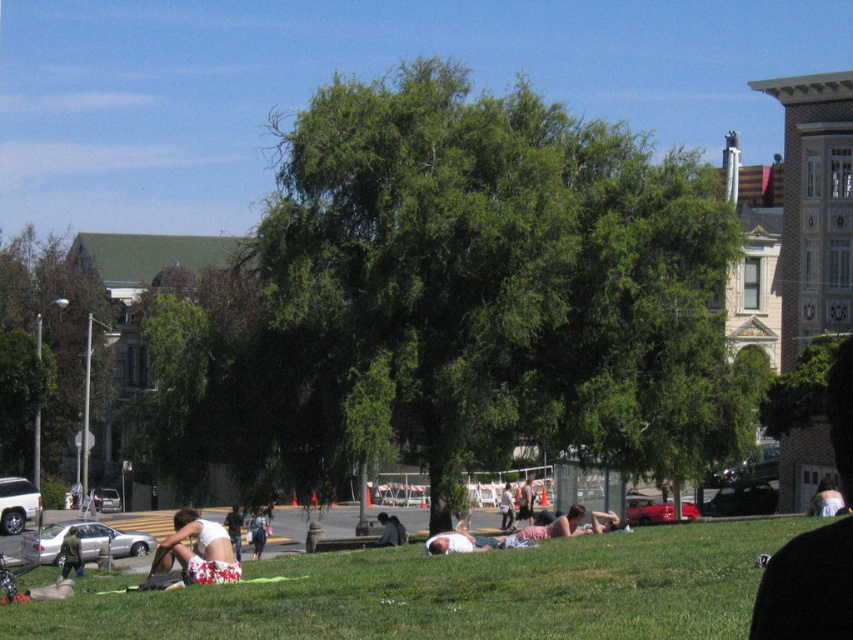
Question: In this image, where is green leafy tree at center located relative to dark gray shirt at center?

Choices:
 (A) below
 (B) above

Answer: (B)

Question: Is white floral shorts at lower left positioned before white fabric person at center?

Choices:
 (A) no
 (B) yes

Answer: (B)

Question: Which point is farther from the camera taking this photo?

Choices:
 (A) (230, 577)
 (B) (3, 387)
 (C) (451, 550)
 (D) (798, 586)

Answer: (B)

Question: Among these objects, which one is farthest from the camera?

Choices:
 (A) white fabric person at center
 (B) green leafy tree at center
 (C) dark gray shirt at center

Answer: (B)

Question: Can you confirm if dark gray shirt at center is positioned above white fabric person at center?

Choices:
 (A) yes
 (B) no

Answer: (A)

Question: Which object is positioned farthest from the green leafy tree at left?

Choices:
 (A) green leafy tree at center
 (B) dark gray shirt at center

Answer: (B)